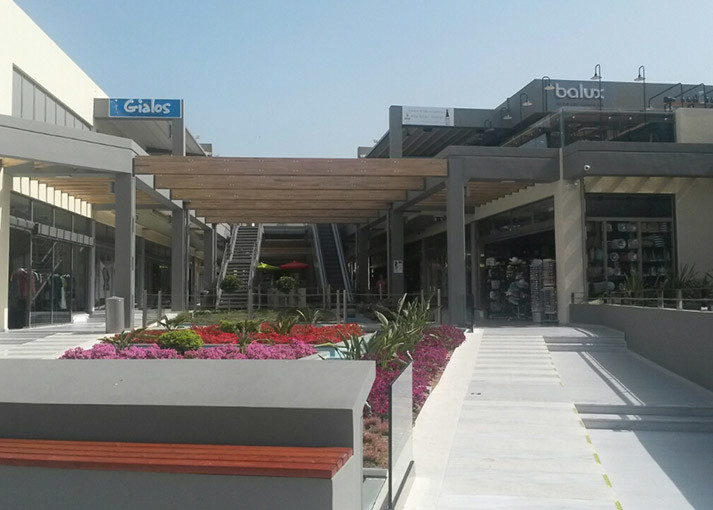
Where is `wood rafters`? wood rafters is located at coordinates (319, 164), (319, 178), (312, 195), (317, 207), (324, 220), (483, 194), (98, 188), (150, 224).